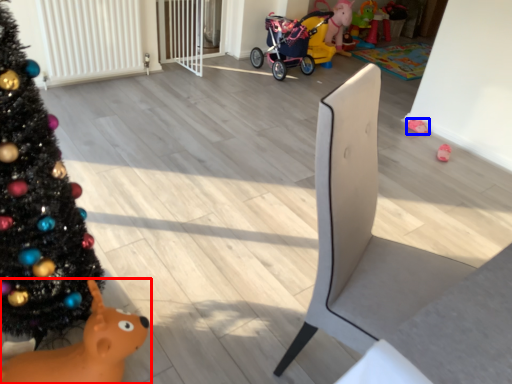
Question: Which object appears closest to the camera in this image, toy (highlighted by a red box) or toy (highlighted by a blue box)?

Choices:
 (A) toy
 (B) toy

Answer: (A)